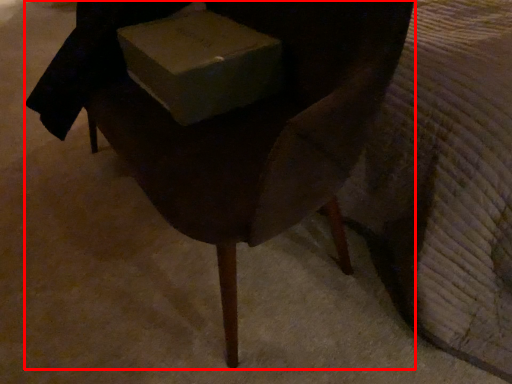
Question: From the image, what is the correct spatial relationship of chair (annotated by the red box) in relation to box?

Choices:
 (A) left
 (B) right

Answer: (A)